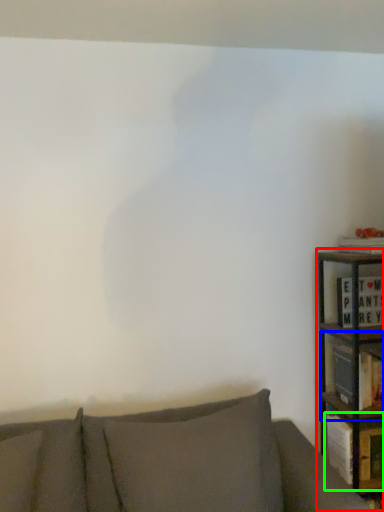
Question: Estimate the real-world distances between objects in this image. Which object is farther from bookcase (highlighted by a red box), shelf (highlighted by a blue box) or book (highlighted by a green box)?

Choices:
 (A) shelf
 (B) book

Answer: (B)